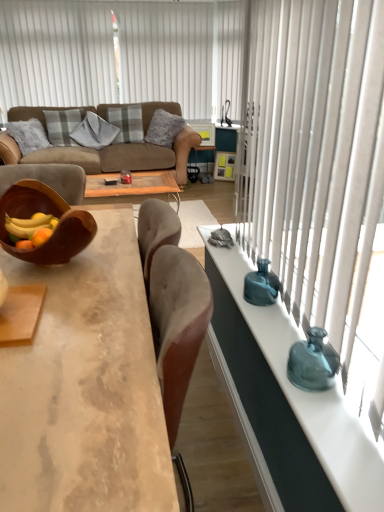
Question: Is plaid fabric pillow at upper left, the fourth pillow when ordered from right to left, to the left of teal glass vase at right, placed as the 1th vase when sorted from bottom to top, from the viewer's perspective?

Choices:
 (A) no
 (B) yes

Answer: (B)

Question: Is teal glass vase at right, marked as the 2th vase in a back-to-front arrangement, inside plaid fabric pillow at upper left, which is the 1th pillow from left to right?

Choices:
 (A) yes
 (B) no

Answer: (B)

Question: Does plaid fabric pillow at upper left, which is the 1th pillow from left to right, come behind teal glass vase at right, placed as the 2th vase when sorted from top to bottom?

Choices:
 (A) yes
 (B) no

Answer: (A)

Question: Is plaid fabric pillow at upper left, the fourth pillow when ordered from right to left, wider than teal glass vase at right, marked as the 2th vase in a back-to-front arrangement?

Choices:
 (A) no
 (B) yes

Answer: (B)

Question: From the image's perspective, is teal glass vase at right, placed as the 2th vase when sorted from top to bottom, located above or below teal glass vase at right?

Choices:
 (A) above
 (B) below

Answer: (B)

Question: In terms of height, does teal glass vase at right, placed as the 2th vase when sorted from top to bottom, look taller or shorter compared to teal glass vase at right?

Choices:
 (A) short
 (B) tall

Answer: (A)

Question: From a real-world perspective, is teal glass vase at right, marked as the 2th vase in a back-to-front arrangement, above or below teal glass vase at right?

Choices:
 (A) above
 (B) below

Answer: (B)

Question: Considering the positions of teal glass vase at right, placed as the 2th vase when sorted from top to bottom, and teal glass vase at right in the image, is teal glass vase at right, placed as the 2th vase when sorted from top to bottom, bigger or smaller than teal glass vase at right?

Choices:
 (A) big
 (B) small

Answer: (B)

Question: Visually, is teal glass vase at right positioned to the left or to the right of brown wooden bowl at left?

Choices:
 (A) right
 (B) left

Answer: (A)

Question: Considering the positions of teal glass vase at right and brown wooden bowl at left in the image, is teal glass vase at right taller or shorter than brown wooden bowl at left?

Choices:
 (A) short
 (B) tall

Answer: (A)

Question: Looking at the image, does teal glass vase at right seem bigger or smaller compared to brown wooden bowl at left?

Choices:
 (A) big
 (B) small

Answer: (B)

Question: From the image's perspective, is teal glass vase at right located above or below brown wooden bowl at left?

Choices:
 (A) above
 (B) below

Answer: (B)

Question: From the image's perspective, is gray textured pillow at center, acting as the third pillow starting from the right, above or below concrete textured coffee table at center?

Choices:
 (A) above
 (B) below

Answer: (A)

Question: Is gray textured pillow at center, acting as the third pillow starting from the right, taller or shorter than concrete textured coffee table at center?

Choices:
 (A) short
 (B) tall

Answer: (A)